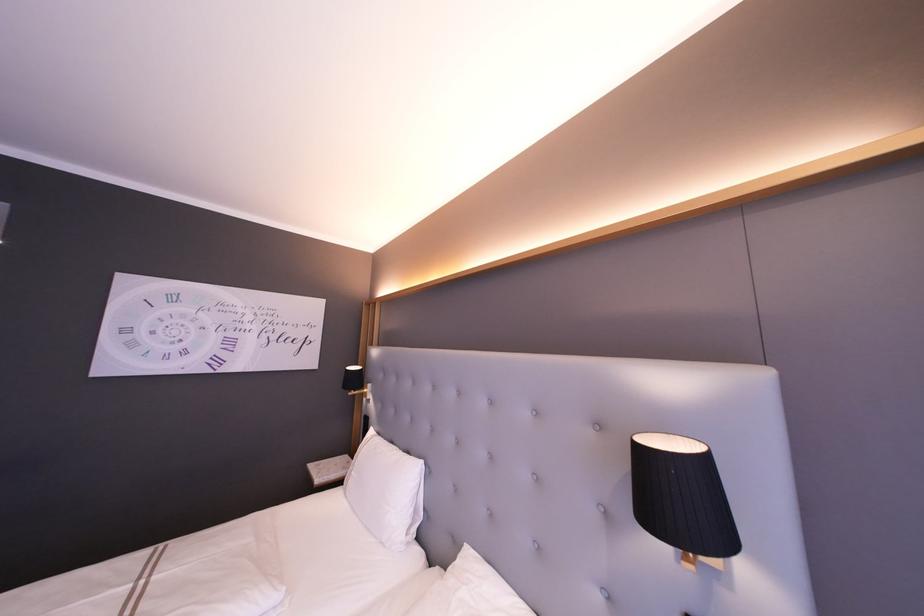
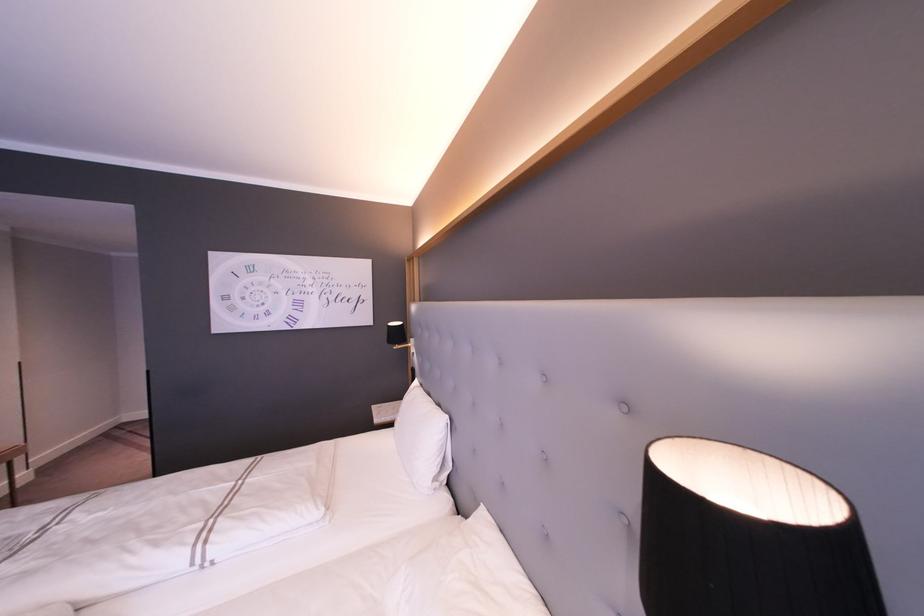
Question: The images are taken continuously from a first-person perspective. In which direction is your viewpoint rotating?

Choices:
 (A) Left
 (B) Right
 (C) Up
 (D) Down

Answer: (A)